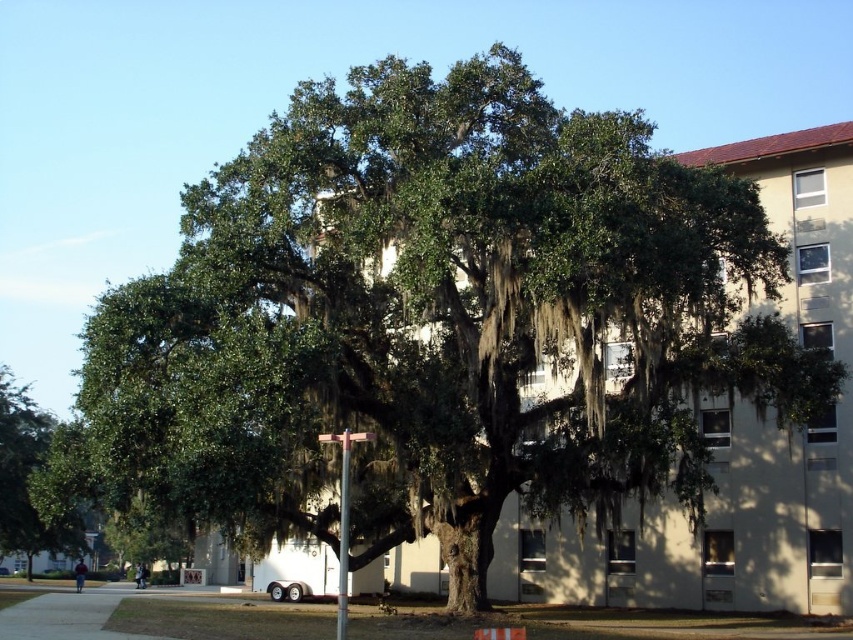
You are standing at the edge of the green grass at lower center and want to get a better view of the green leafy tree at lower left. Which direction should you move to see more of the tree?

The green grass at lower center is not as tall as the green leafy tree at lower left, so moving forward towards the tree would allow you to see more of it since the grass is shorter and less obstructive.